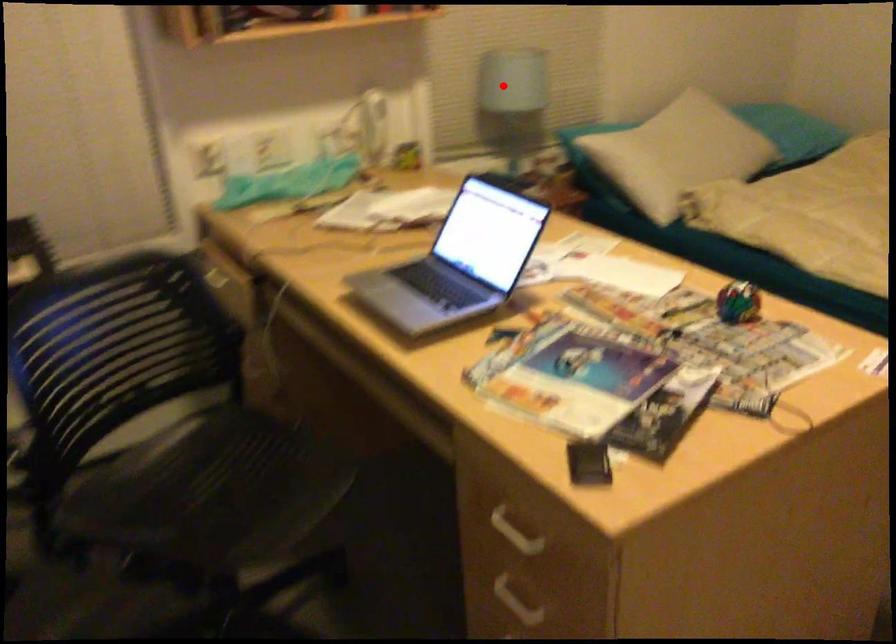
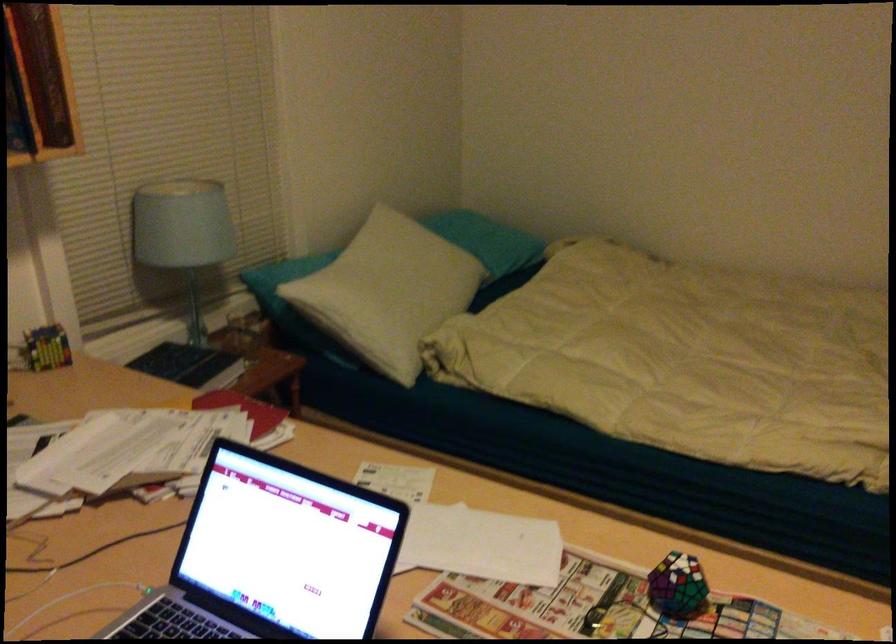
Question: I am providing you with two images of the same scene from different viewpoints. A red point is shown in image1. For the corresponding object point in image2, is it positioned nearer or farther from the camera?

Choices:
 (A) Nearer
 (B) Farther

Answer: (A)